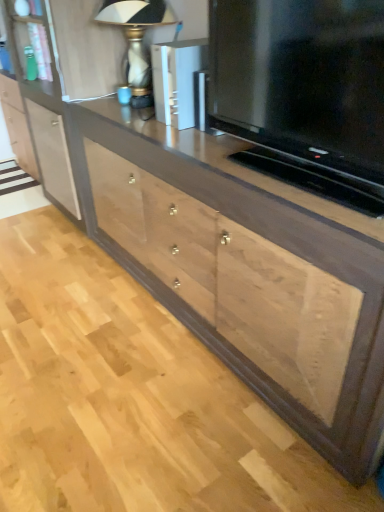
Locate an element on the screen. This screenshot has width=384, height=512. free region on the left part of metallic silver speaker at upper center is located at coordinates (137, 121).